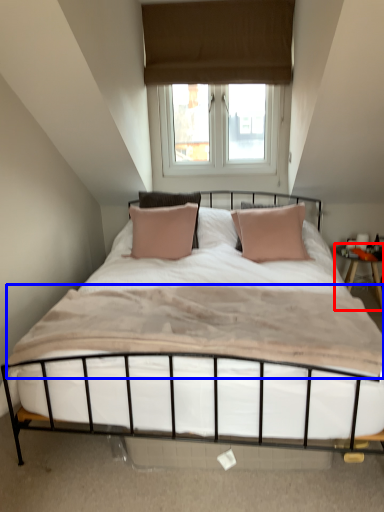
Question: Which object is further to the camera taking this photo, nightstand (highlighted by a red box) or mattress (highlighted by a blue box)?

Choices:
 (A) nightstand
 (B) mattress

Answer: (A)